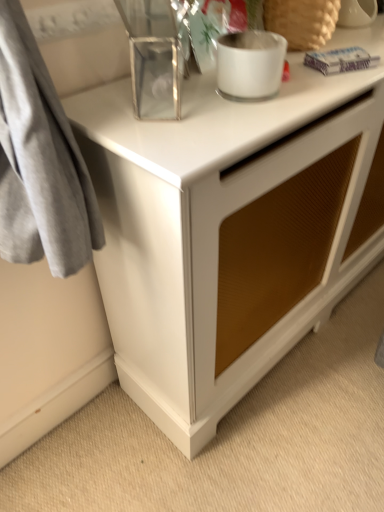
Question: Can you confirm if frosted glass candle at upper center, which ranks as the second appliance in right-to-left order, is smaller than white ceramic vase at upper right, the third appliance positioned from the left?

Choices:
 (A) yes
 (B) no

Answer: (A)

Question: Can you confirm if frosted glass candle at upper center, the 2th appliance in the left-to-right sequence, is thinner than white ceramic vase at upper right, the third appliance positioned from the left?

Choices:
 (A) no
 (B) yes

Answer: (A)

Question: Is white ceramic vase at upper right, which is the 1th appliance from right to left, inside frosted glass candle at upper center, the 2th appliance in the left-to-right sequence?

Choices:
 (A) yes
 (B) no

Answer: (B)

Question: Does frosted glass candle at upper center, which ranks as the second appliance in right-to-left order, come in front of white ceramic vase at upper right, the third appliance positioned from the left?

Choices:
 (A) yes
 (B) no

Answer: (A)

Question: Does frosted glass candle at upper center, the 2th appliance in the left-to-right sequence, have a larger size compared to white ceramic vase at upper right, which is the 1th appliance from right to left?

Choices:
 (A) yes
 (B) no

Answer: (B)

Question: Considering the relative positions of frosted glass candle at upper center, the 2th appliance in the left-to-right sequence, and white ceramic vase at upper right, the third appliance positioned from the left, in the image provided, is frosted glass candle at upper center, the 2th appliance in the left-to-right sequence, to the right of white ceramic vase at upper right, the third appliance positioned from the left, from the viewer's perspective?

Choices:
 (A) yes
 (B) no

Answer: (B)

Question: Is clear glass rectangular box at upper center, which ranks as the 1th appliance in left-to-right order, oriented away from white ceramic vase at upper right, the third appliance positioned from the left?

Choices:
 (A) yes
 (B) no

Answer: (B)

Question: Does clear glass rectangular box at upper center, acting as the third appliance starting from the right, have a larger size compared to white ceramic vase at upper right, which is the 1th appliance from right to left?

Choices:
 (A) no
 (B) yes

Answer: (B)

Question: From a real-world perspective, does clear glass rectangular box at upper center, which ranks as the 1th appliance in left-to-right order, stand above white ceramic vase at upper right, the third appliance positioned from the left?

Choices:
 (A) no
 (B) yes

Answer: (B)

Question: Does clear glass rectangular box at upper center, acting as the third appliance starting from the right, lie in front of white ceramic vase at upper right, which is the 1th appliance from right to left?

Choices:
 (A) yes
 (B) no

Answer: (A)

Question: Can you confirm if clear glass rectangular box at upper center, acting as the third appliance starting from the right, is thinner than white ceramic vase at upper right, which is the 1th appliance from right to left?

Choices:
 (A) no
 (B) yes

Answer: (A)

Question: Considering the relative sizes of clear glass rectangular box at upper center, acting as the third appliance starting from the right, and white ceramic vase at upper right, which is the 1th appliance from right to left, in the image provided, is clear glass rectangular box at upper center, acting as the third appliance starting from the right, smaller than white ceramic vase at upper right, which is the 1th appliance from right to left,?

Choices:
 (A) no
 (B) yes

Answer: (A)

Question: Does white ceramic vase at upper right, the third appliance positioned from the left, have a greater width compared to clear glass rectangular box at upper center, which ranks as the 1th appliance in left-to-right order?

Choices:
 (A) no
 (B) yes

Answer: (A)